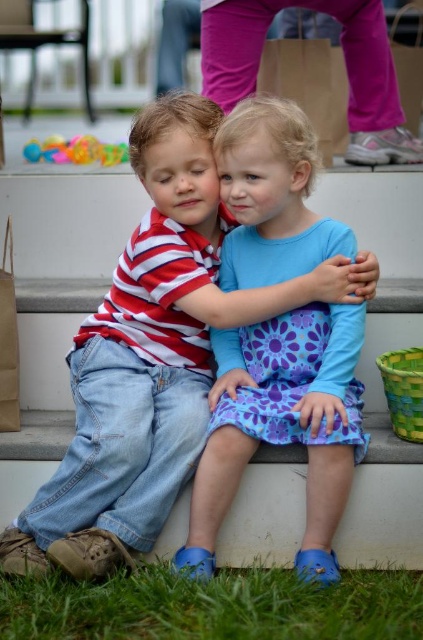
Does blue cotton dress at center appear over pink fabric pants at upper center?

Incorrect, blue cotton dress at center is not positioned above pink fabric pants at upper center.

Can you confirm if blue cotton dress at center is wider than pink fabric pants at upper center?

Incorrect, blue cotton dress at center's width does not surpass pink fabric pants at upper center's.

Does point (315, 413) come closer to viewer compared to point (220, 84)?

Yes.

At what (x,y) coordinates should I click in order to perform the action: click on blue cotton dress at center. Please return your answer as a coordinate pair (x, y). Looking at the image, I should click on (282, 424).

Is pink fabric pants at upper center further to camera compared to translucent plastic toys at upper left?

No, it is in front of translucent plastic toys at upper left.

Identify the location of pink fabric pants at upper center. (345, 61).

Who is more distant from viewer, (357, 20) or (40, 147)?

Positioned behind is point (40, 147).

Find the location of `pink fabric pants at upper center`. pink fabric pants at upper center is located at coordinates (345, 61).

Is green grass at lower center to the left of translucent plastic toys at upper left from the viewer's perspective?

Incorrect, green grass at lower center is not on the left side of translucent plastic toys at upper left.

Is point (233, 618) closer to camera compared to point (79, 144)?

Yes, it is.

You are a GUI agent. You are given a task and a screenshot of the screen. Output one action in this format:
    pyautogui.click(x=<x>, y=<y>)
    Task: Click on the green grass at lower center
    Image resolution: width=423 pixels, height=640 pixels.
    Given the screenshot: What is the action you would take?
    pyautogui.click(x=214, y=605)

What are the coordinates of `green grass at lower center` in the screenshot? It's located at (214, 605).